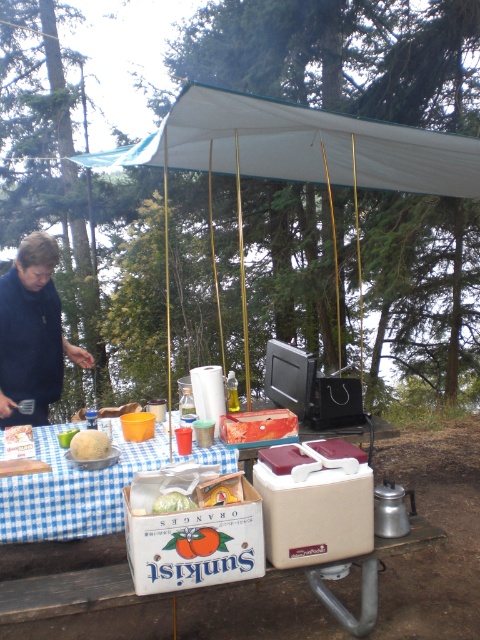
Question: Does white fabric canopy at upper center come behind blue checkered tablecloth at lower left?

Choices:
 (A) yes
 (B) no

Answer: (B)

Question: Which point is farther to the camera?

Choices:
 (A) blue checkered tablecloth at lower left
 (B) dark blue fabric at left
 (C) orange printed cardboard box at center
 (D) white fabric canopy at upper center

Answer: (B)

Question: Observing the image, what is the correct spatial positioning of white fabric canopy at upper center in reference to translucent plastic bag at center?

Choices:
 (A) above
 (B) below

Answer: (A)

Question: Which of the following is the closest to the observer?

Choices:
 (A) dark blue fabric at left
 (B) translucent plastic bag at center
 (C) orange printed cardboard box at center
 (D) white fabric canopy at upper center

Answer: (C)

Question: Can you confirm if orange printed cardboard box at center is smaller than translucent plastic bag at center?

Choices:
 (A) no
 (B) yes

Answer: (A)

Question: Which point is farther to the camera?

Choices:
 (A) translucent plastic bag at center
 (B) white fabric canopy at upper center
 (C) blue checkered tablecloth at lower left

Answer: (C)